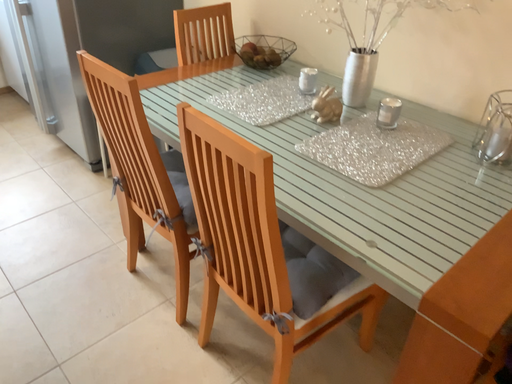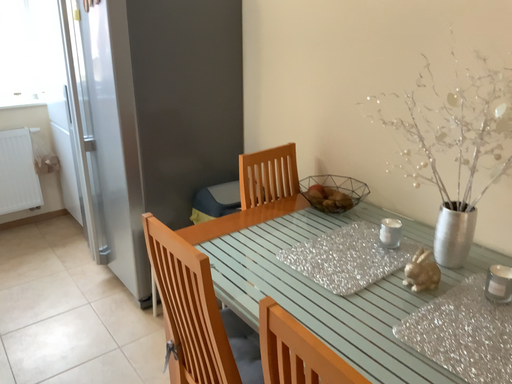
Question: Which way did the camera rotate in the video?

Choices:
 (A) rotated downward
 (B) rotated upward

Answer: (B)